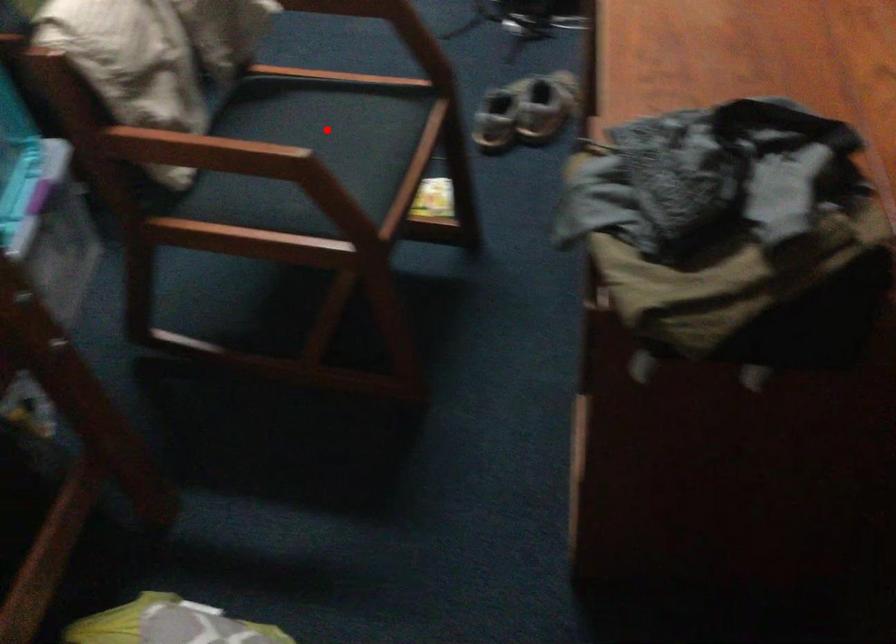
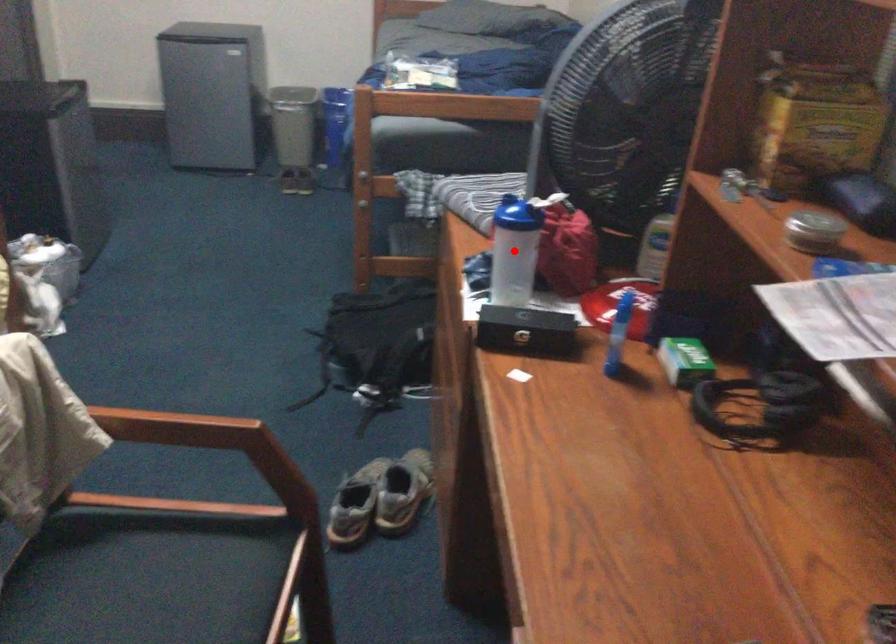
I am providing you with two images of the same scene from different viewpoints. A red point is marked on the first image and another point is marked on the second image. Does the point marked in image1 correspond to the same location as the one in image2?

No